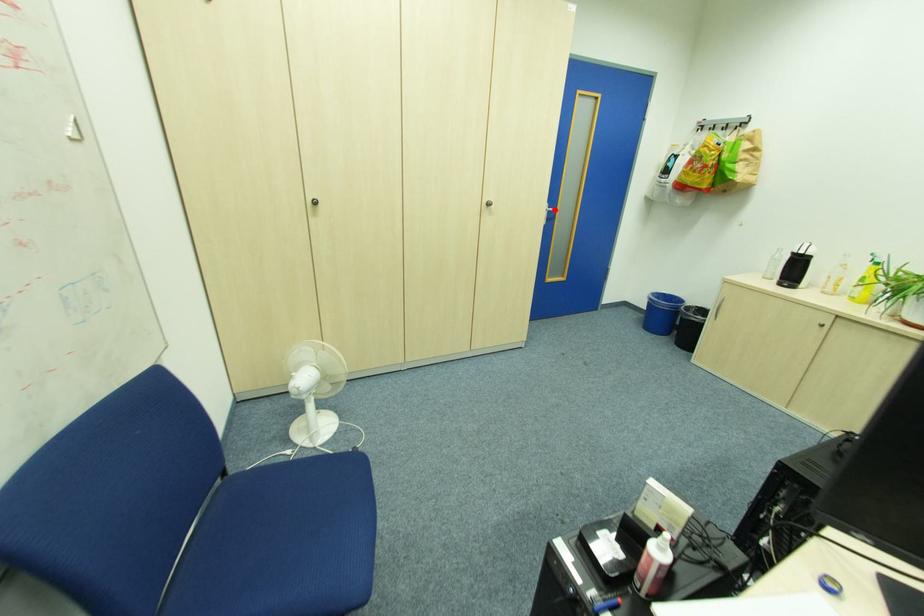
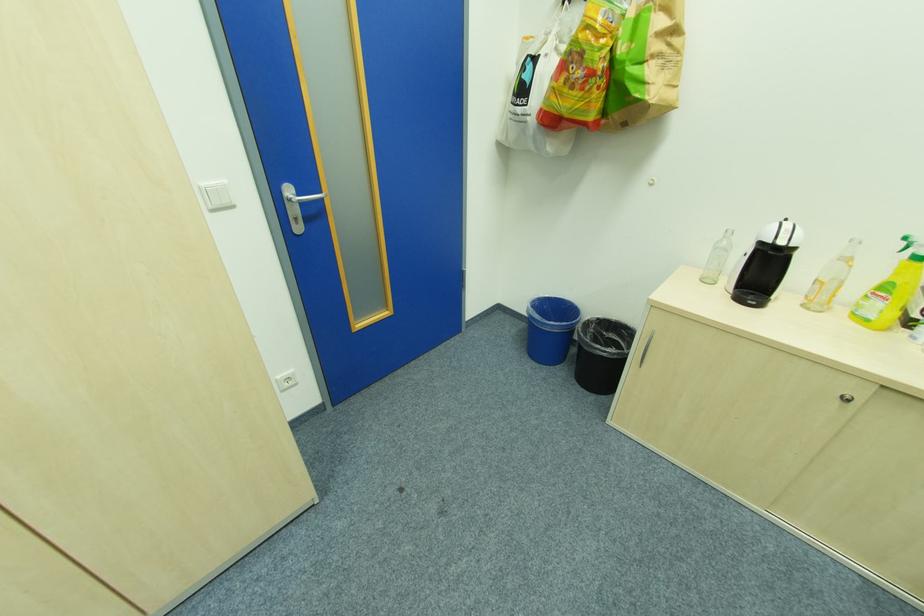
Question: I am providing you with two images of the same scene from different viewpoints. A red point is marked on the first image. Is the red point's position out of view in image 2?

Choices:
 (A) Yes
 (B) No

Answer: (B)